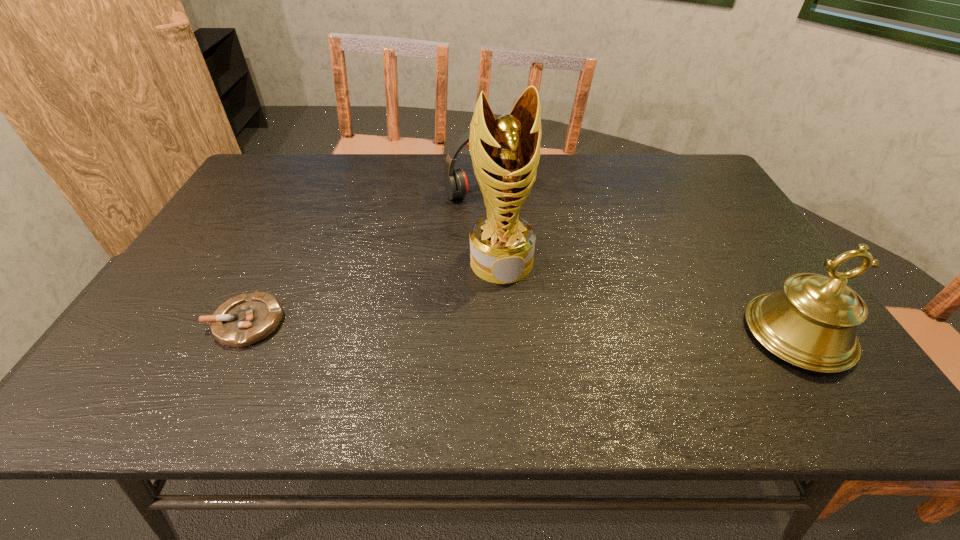
Where is `free spot between the bell and the second shortest object`? This screenshot has height=540, width=960. free spot between the bell and the second shortest object is located at coordinates (642, 262).

At what (x,y) coordinates should I click in order to perform the action: click on unoccupied area between the farthest object and the rightmost object. Please return your answer as a coordinate pair (x, y). Looking at the image, I should click on click(642, 262).

Where is `free point between the tallest object and the bell`? This screenshot has height=540, width=960. free point between the tallest object and the bell is located at coordinates (650, 298).

The height and width of the screenshot is (540, 960). I want to click on vacant area that lies between the earphone and the rightmost object, so click(642, 262).

In order to click on blank region between the shortest object and the second shortest object in this screenshot , I will do `click(366, 256)`.

Where is `free space between the farthest object and the shortest object`? The width and height of the screenshot is (960, 540). free space between the farthest object and the shortest object is located at coordinates (366, 256).

The image size is (960, 540). What are the coordinates of `free space between the award and the shortest object` in the screenshot? It's located at (374, 292).

Where is `vacant area between the rightmost object and the award`? The image size is (960, 540). vacant area between the rightmost object and the award is located at coordinates (650, 298).

You are a GUI agent. You are given a task and a screenshot of the screen. Output one action in this format:
    pyautogui.click(x=<x>, y=<y>)
    Task: Click on the empty space that is in between the shortest object and the farthest object
    The image size is (960, 540).
    Given the screenshot: What is the action you would take?
    pyautogui.click(x=366, y=256)

Identify which object is the second closest to the earphone. Please provide its 2D coordinates. Your answer should be formatted as a tuple, i.e. [(x, y)], where the tuple contains the x and y coordinates of a point satisfying the conditions above.

[(246, 319)]